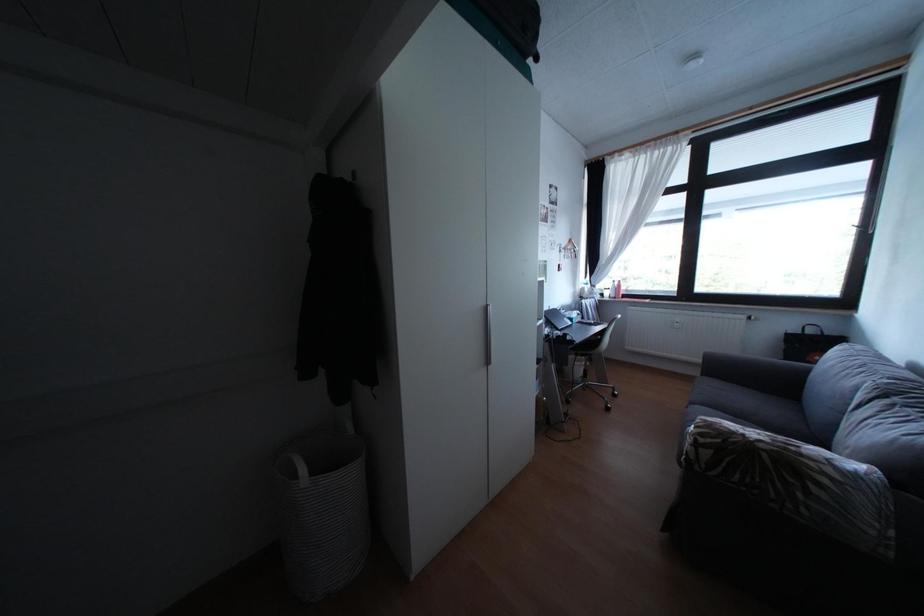
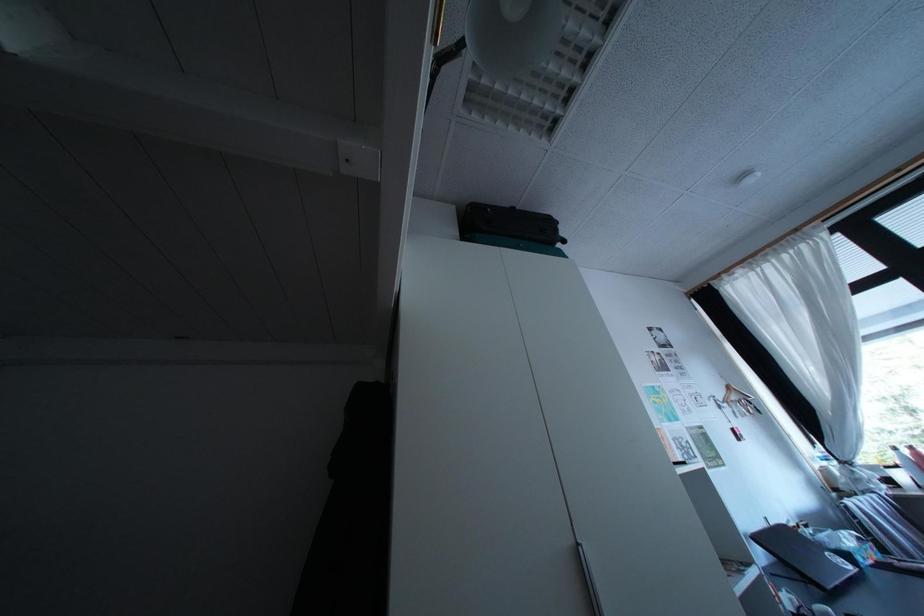
The first image is from the beginning of the video and the second image is from the end. How did the camera likely rotate when shooting the video?

The rotation direction of the camera is left-up.